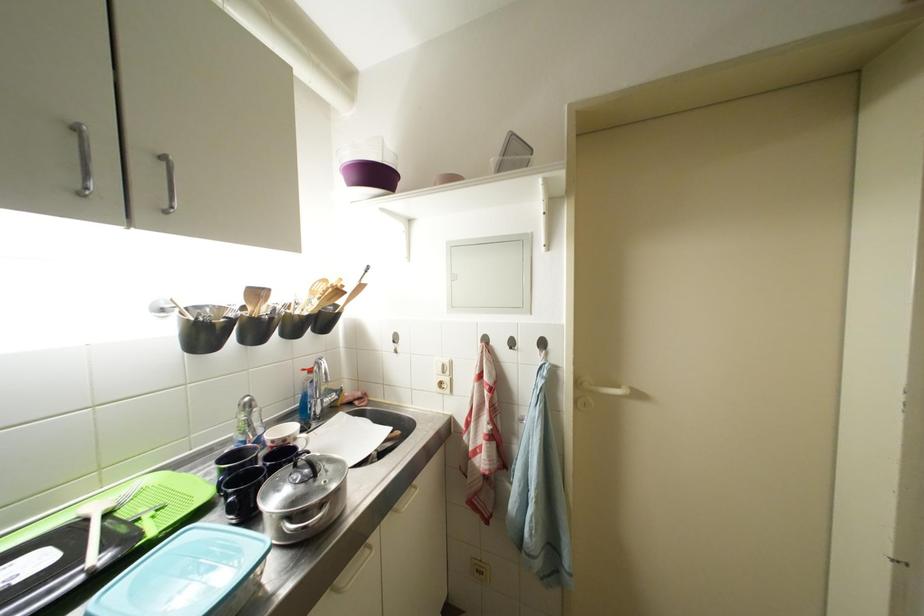
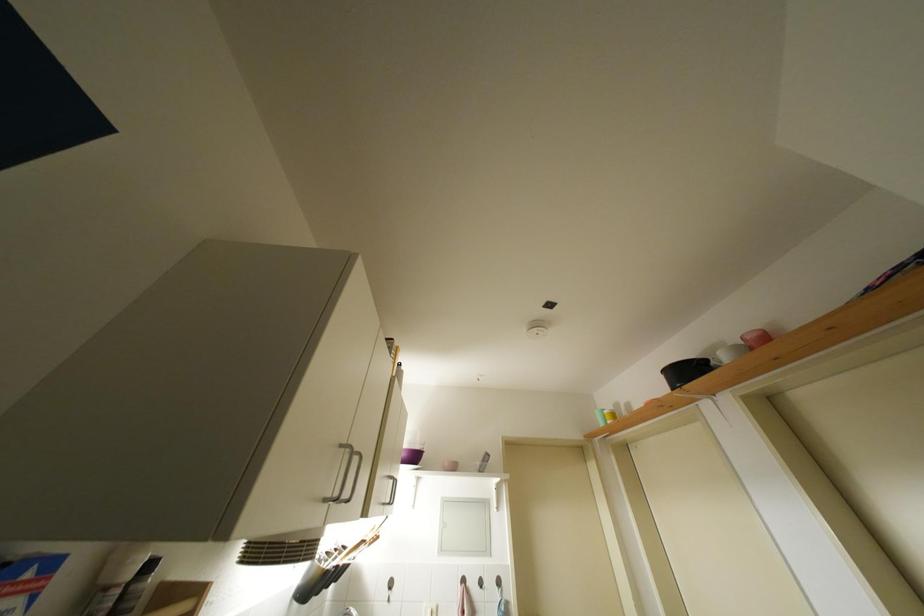
Find the pixel in the second image that matches pixel 459 310 in the first image.

(447, 554)